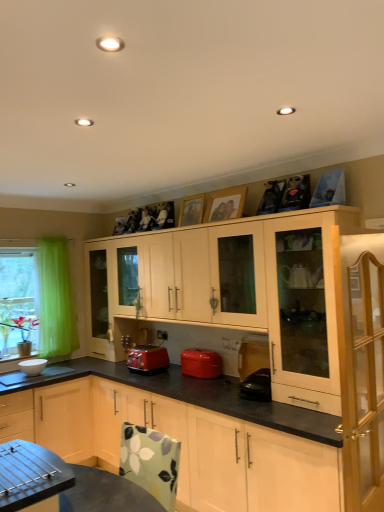
Question: Is point pyautogui.click(x=39, y=368) positioned closer to the camera than point pyautogui.click(x=316, y=262)?

Choices:
 (A) farther
 (B) closer

Answer: (A)

Question: From a real-world perspective, relative to light wood cabinet at upper right, the 1th cabinetry in the back-to-front sequence, is white glossy bowl at lower left, marked as the second appliance in a right-to-left arrangement, vertically above or below?

Choices:
 (A) below
 (B) above

Answer: (A)

Question: Which is farther from the matte red toaster at center, the first kitchen appliance from the left?

Choices:
 (A) floral fabric table at lower left
 (B) matte red toaster at center, placed as the first kitchen appliance when sorted from right to left
 (C) matte black kettle at lower center, the second appliance when ordered from left to right
 (D) light wood cabinet at upper right, placed as the third cabinetry when sorted from front to back
 (E) white glossy bowl at lower left

Answer: (A)

Question: Estimate the real-world distances between objects in this image. Which object is farther from the green sheer curtain at left?

Choices:
 (A) white glossy bowl at lower left, the second appliance from the front
 (B) floral fabric table at lower left
 (C) light wood cabinet at center, positioned as the second cabinetry in front-to-back order
 (D) white glossy bowl at lower left
 (E) matte black kettle at lower center, the 1th appliance when ordered from right to left

Answer: (B)